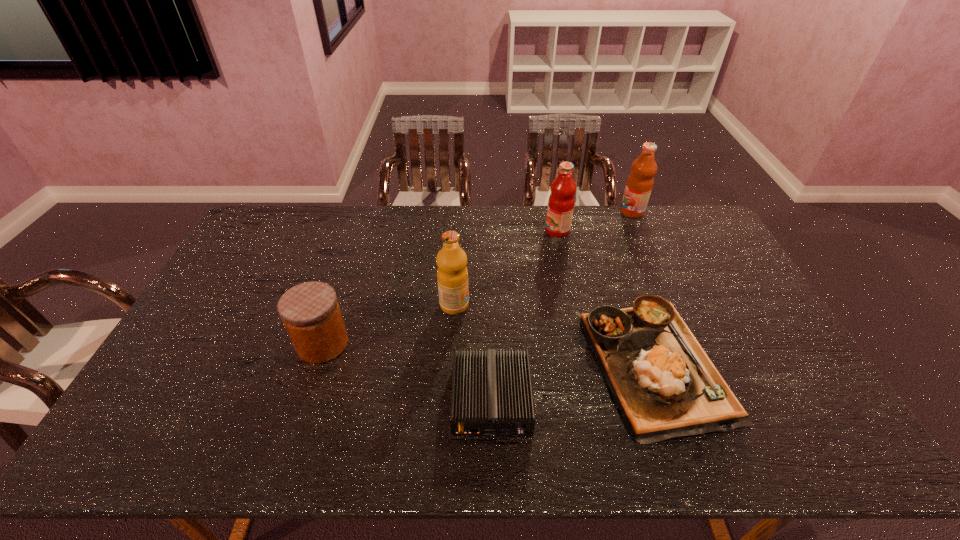
This screenshot has height=540, width=960. I want to click on vacant space located on the front label of the farthest object, so click(536, 212).

Where is `vacant space situated 0.280m on the front label of the farthest object`? This screenshot has width=960, height=540. vacant space situated 0.280m on the front label of the farthest object is located at coordinates (548, 212).

The image size is (960, 540). I want to click on vacant area located on the front label of the second fruit juice from left to right, so click(x=474, y=231).

Find the location of `vacant space located 0.150m on the front label of the second fruit juice from left to right`. vacant space located 0.150m on the front label of the second fruit juice from left to right is located at coordinates (504, 231).

The image size is (960, 540). What are the coordinates of `free space located on the front label of the second fruit juice from left to right` in the screenshot? It's located at (443, 231).

Find the location of `free space located 0.060m on the front label of the leftmost fruit juice`. free space located 0.060m on the front label of the leftmost fruit juice is located at coordinates (489, 305).

Find the location of a particular element. vacant space positioned 0.160m on the right of the leftmost object is located at coordinates (405, 343).

At what (x,y) coordinates should I click in order to perform the action: click on free space located 0.180m on the right of the platter. Please return your answer as a coordinate pair (x, y). This screenshot has width=960, height=540. Looking at the image, I should click on (787, 363).

I want to click on platter situated at the near edge, so (665, 385).

The image size is (960, 540). What are the coordinates of `router at the near edge` in the screenshot? It's located at (492, 394).